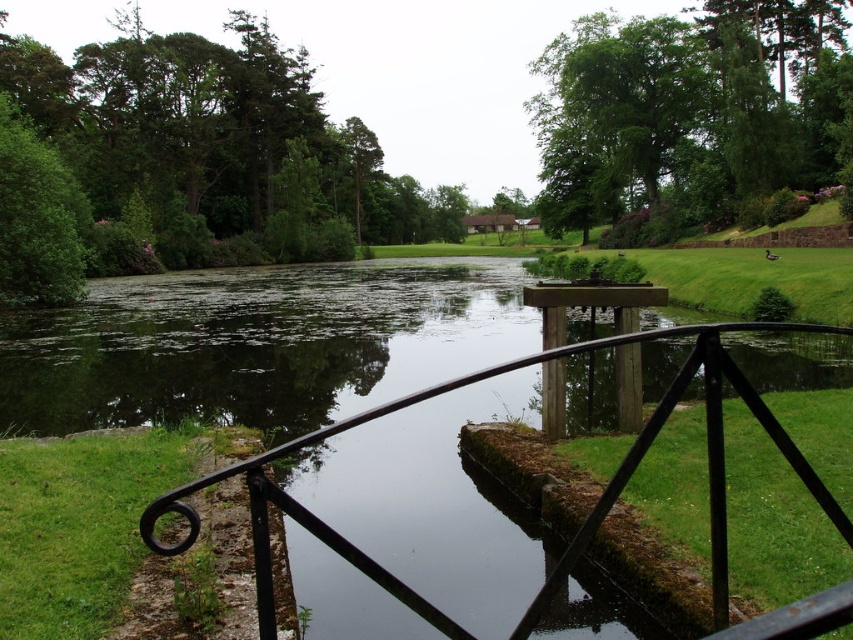
You are standing at the edge of the pond near the black metal railing and want to take a photo of both the green leafy tree at upper center and the green leafy tree at upper left. Which tree should you focus on first if you want to capture both in the same frame without moving your camera?

You should focus on the green leafy tree at upper center first because it is taller than the green leafy tree at upper left, allowing it to be more prominent in the frame while still including the smaller tree in the background.

You are standing at the edge of the pond near the black metal railing. Looking towards the green leafy tree at upper center, in which direction should you walk to get closer to it?

The green leafy tree at upper center is located at point coordinates of 0.175 on the x axis and 0.809 on the y axis. Since the tree is at upper center, you should walk forward to approach it from your current position at the edge of the pond.

You are standing at the edge of the pond and see a point marked at coordinates [689,112]. What object is located at that point?

The point at coordinates [689,112] corresponds to the green leafy tree at upper center.